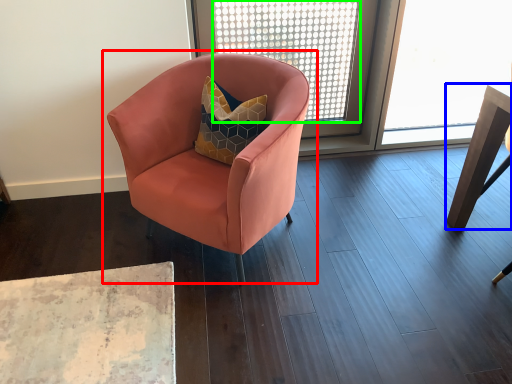
Question: Considering the real-world distances, which object is closest to chair (highlighted by a red box)? table (highlighted by a blue box) or window screen (highlighted by a green box).

Choices:
 (A) table
 (B) window screen

Answer: (A)